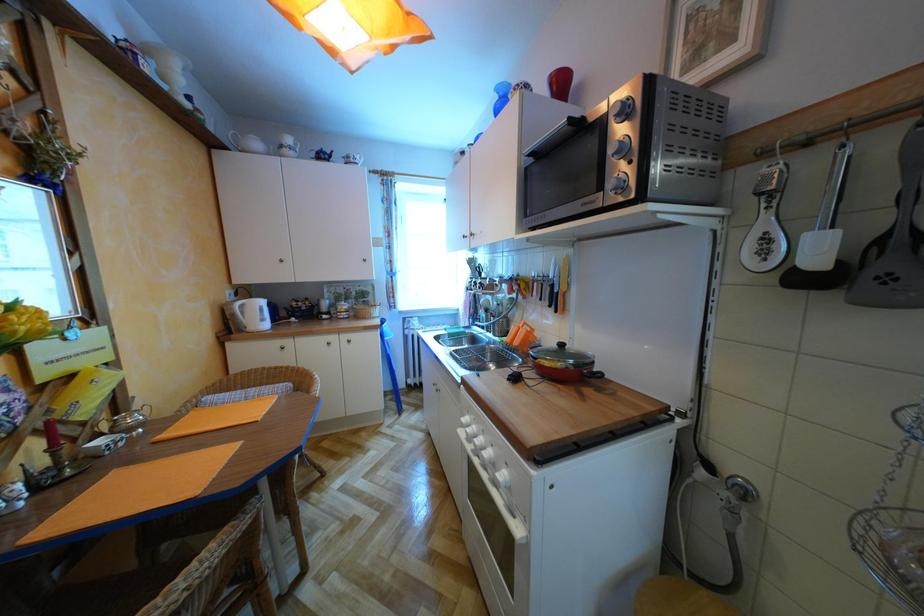
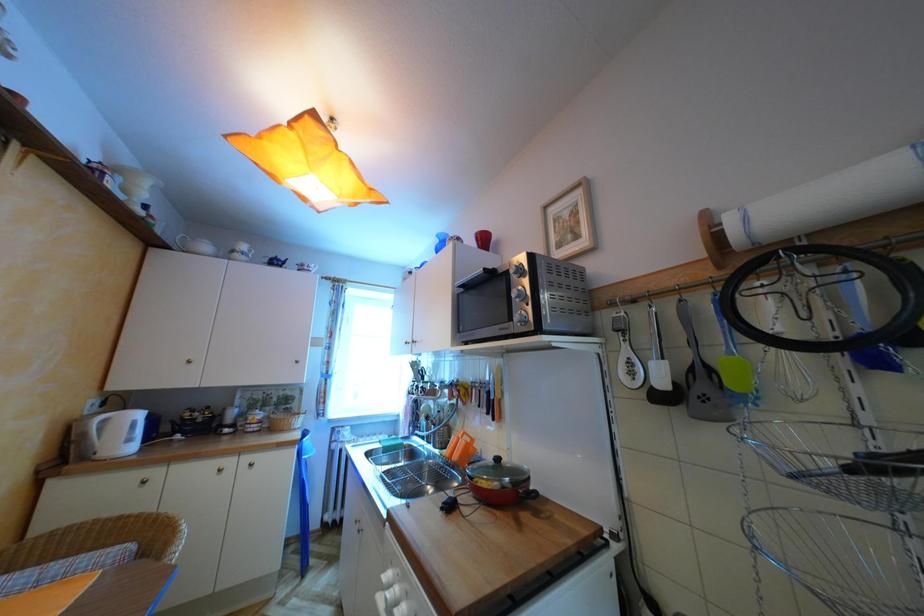
In a continuous first-person perspective shot, in which direction is the camera moving?

The movement direction of the cameraman is right, backward.